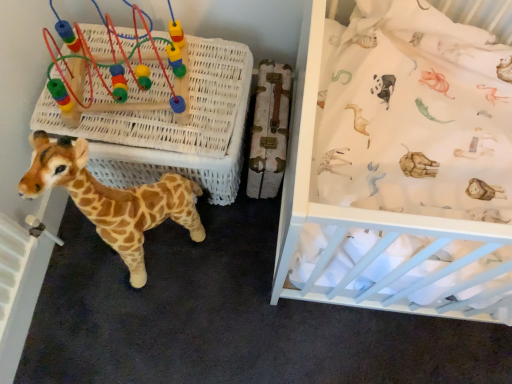
Identify the location of white fabric at upper right. The image size is (512, 384). (403, 171).

Find the location of a particular element. white wicker basket at center is located at coordinates (167, 122).

Image resolution: width=512 pixels, height=384 pixels. Find the location of `white fabric at upper right`. white fabric at upper right is located at coordinates (403, 171).

Which object is more forward, white wicker basket at center or white fabric at upper right?

white fabric at upper right is more forward.

From the image's perspective, relative to white fabric at upper right, is white wicker basket at center above or below?

white wicker basket at center is above white fabric at upper right.

Does point (216, 125) come in front of point (330, 223)?

No, it is behind (330, 223).

Is soft plush giraffe at lower left beside white fabric at upper right?

No, soft plush giraffe at lower left is not making contact with white fabric at upper right.

In the scene shown: Could you tell me if soft plush giraffe at lower left is facing white fabric at upper right?

No, soft plush giraffe at lower left does not turn towards white fabric at upper right.

Relative to white fabric at upper right, is soft plush giraffe at lower left in front or behind?

soft plush giraffe at lower left is positioned farther from the viewer than white fabric at upper right.

Locate an element on the screen. The image size is (512, 384). giraffe below the white fabric at upper right (from a real-world perspective) is located at coordinates (112, 199).

Considering the relative positions of white fabric at upper right and soft plush giraffe at lower left in the image provided, is white fabric at upper right to the right of soft plush giraffe at lower left from the viewer's perspective?

Indeed, white fabric at upper right is positioned on the right side of soft plush giraffe at lower left.

Who is taller, white fabric at upper right or soft plush giraffe at lower left?

white fabric at upper right.

Measure the distance between white fabric at upper right and soft plush giraffe at lower left.

white fabric at upper right and soft plush giraffe at lower left are 21.59 inches apart.

From a real-world perspective, which object stands above the other?

white fabric at upper right is physically above.

Considering the relative positions of soft plush giraffe at lower left and plastic beads at upper left in the image provided, is soft plush giraffe at lower left in front of plastic beads at upper left?

Yes, soft plush giraffe at lower left is closer to the viewer.

Is soft plush giraffe at lower left facing towards plastic beads at upper left?

No, soft plush giraffe at lower left is not aimed at plastic beads at upper left.

Is soft plush giraffe at lower left not close to plastic beads at upper left?

No, soft plush giraffe at lower left is not far away from plastic beads at upper left.

Considering the sizes of soft plush giraffe at lower left and plastic beads at upper left in the image, is soft plush giraffe at lower left wider or thinner than plastic beads at upper left?

Considering their sizes, soft plush giraffe at lower left looks slimmer than plastic beads at upper left.

Is soft plush giraffe at lower left at the back of plastic beads at upper left?

No, soft plush giraffe at lower left is not at the back of plastic beads at upper left.

Is soft plush giraffe at lower left surrounded by plastic beads at upper left?

No, soft plush giraffe at lower left is located outside of plastic beads at upper left.

Is plastic beads at upper left positioned before soft plush giraffe at lower left?

No, the depth of plastic beads at upper left is greater than that of soft plush giraffe at lower left.

Which of these two, plastic beads at upper left or soft plush giraffe at lower left, is smaller?

plastic beads at upper left.

Considering the relative positions of white wicker basket at center and soft plush giraffe at lower left in the image provided, is white wicker basket at center to the right of soft plush giraffe at lower left from the viewer's perspective?

Indeed, white wicker basket at center is positioned on the right side of soft plush giraffe at lower left.

From a real-world perspective, who is located higher, white wicker basket at center or soft plush giraffe at lower left?

From a 3D spatial view, soft plush giraffe at lower left is above.

Looking at this image, considering the relative sizes of white wicker basket at center and soft plush giraffe at lower left in the image provided, is white wicker basket at center thinner than soft plush giraffe at lower left?

In fact, white wicker basket at center might be wider than soft plush giraffe at lower left.

Is white wicker basket at center far away from soft plush giraffe at lower left?

They are positioned close to each other.

From a real-world perspective, is white wicker basket at center physically located above or below plastic beads at upper left?

Clearly, from a real-world perspective, white wicker basket at center is below plastic beads at upper left.

Looking at this image, in the image, is white wicker basket at center on the left side or the right side of plastic beads at upper left?

From the image, it's evident that white wicker basket at center is to the right of plastic beads at upper left.

From the picture: Between white wicker basket at center and plastic beads at upper left, which one has smaller width?

plastic beads at upper left is thinner.

Which of these two, white wicker basket at center or plastic beads at upper left, is bigger?

white wicker basket at center.

The image size is (512, 384). Find the location of `infant bed in front of the white wicker basket at center`. infant bed in front of the white wicker basket at center is located at coordinates (403, 171).

Identify the location of infant bed to the right of soft plush giraffe at lower left. (403, 171).

Estimate the real-world distances between objects in this image. Which object is closer to white wicker basket at center, plastic beads at upper left or soft plush giraffe at lower left?

plastic beads at upper left lies closer to white wicker basket at center than the other object.

Considering their positions, is white wicker basket at center positioned closer to plastic beads at upper left than white fabric at upper right?

The object closer to plastic beads at upper left is white wicker basket at center.

When comparing their distances from white fabric at upper right, does white wicker basket at center or soft plush giraffe at lower left seem further?

soft plush giraffe at lower left is further to white fabric at upper right.

Estimate the real-world distances between objects in this image. Which object is further from plastic beads at upper left, soft plush giraffe at lower left or white fabric at upper right?

The object further to plastic beads at upper left is white fabric at upper right.

From the picture: Considering their positions, is plastic beads at upper left positioned further to soft plush giraffe at lower left than white wicker basket at center?

plastic beads at upper left.

Considering their positions, is plastic beads at upper left positioned closer to white fabric at upper right than white wicker basket at center?

Based on the image, white wicker basket at center appears to be nearer to white fabric at upper right.

From the image, which object appears to be nearer to soft plush giraffe at lower left, white fabric at upper right or plastic beads at upper left?

The object closer to soft plush giraffe at lower left is plastic beads at upper left.

Estimate the real-world distances between objects in this image. Which object is closer to white fabric at upper right, plastic beads at upper left or soft plush giraffe at lower left?

soft plush giraffe at lower left is closer to white fabric at upper right.

This screenshot has height=384, width=512. What are the coordinates of `toy between soft plush giraffe at lower left and white wicker basket at center along the z-axis` in the screenshot? It's located at (118, 72).

This screenshot has height=384, width=512. Identify the location of giraffe between plastic beads at upper left and white fabric at upper right. (112, 199).

The width and height of the screenshot is (512, 384). In order to click on crate between soft plush giraffe at lower left and white fabric at upper right in the horizontal direction in this screenshot , I will do `click(167, 122)`.

This screenshot has height=384, width=512. I want to click on crate situated between plastic beads at upper left and white fabric at upper right from left to right, so click(167, 122).